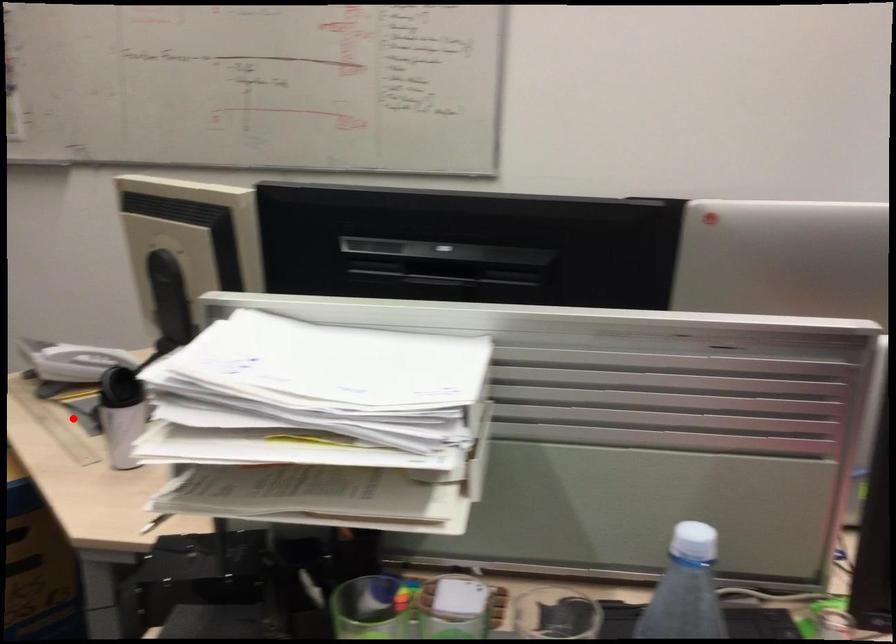
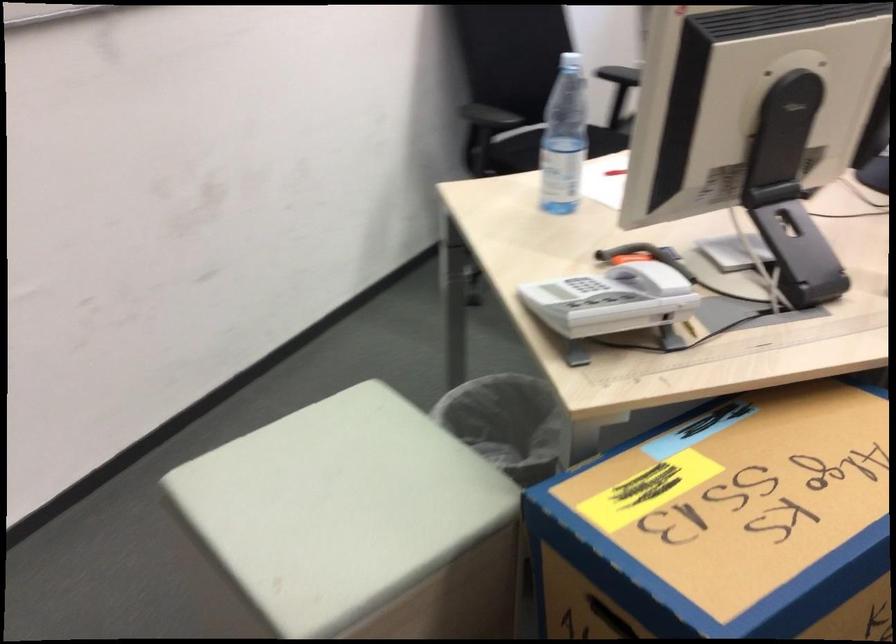
Find the pixel in the second image that matches the highlighted location in the first image.

(746, 334)